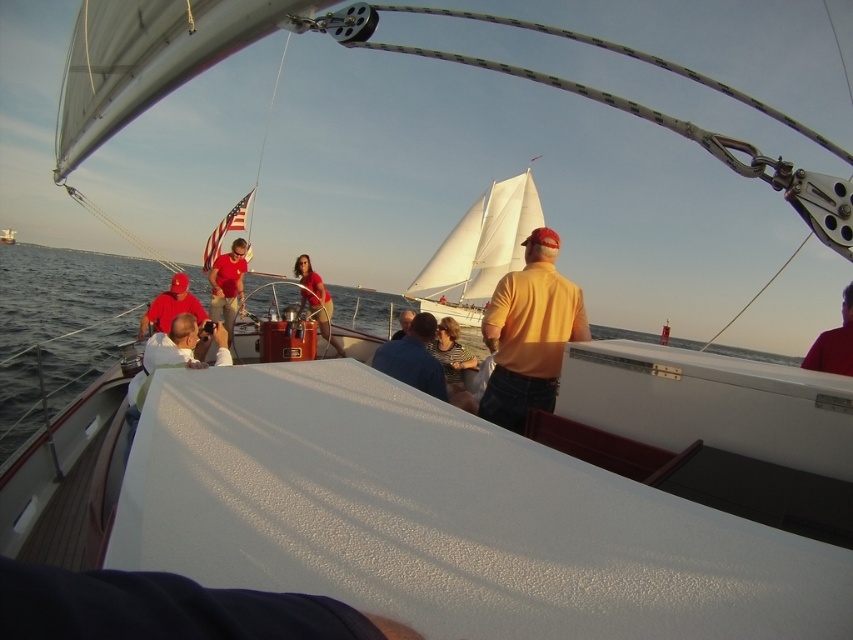
Can you confirm if matte red shorts at center is positioned to the left of striped cotton shirt at center?

Yes, matte red shorts at center is to the left of striped cotton shirt at center.

The image size is (853, 640). Describe the element at coordinates (315, 300) in the screenshot. I see `matte red shorts at center` at that location.

At what (x,y) coordinates should I click in order to perform the action: click on matte red shorts at center. Please return your answer as a coordinate pair (x, y). Image resolution: width=853 pixels, height=640 pixels. Looking at the image, I should click on (315, 300).

Does blue denim shirt at center appear under matte red shirt at center?

Correct, blue denim shirt at center is located below matte red shirt at center.

Is blue denim shirt at center further to the viewer compared to matte red shirt at center?

No, it is not.

Which is behind, point (396, 353) or point (241, 291)?

The point (241, 291) is more distant.

The height and width of the screenshot is (640, 853). I want to click on blue denim shirt at center, so (413, 356).

Which of these two, orange matte shirt at center or matte yellow shirt at center, stands shorter?

Standing shorter between the two is matte yellow shirt at center.

Between point (544, 372) and point (402, 316), which one is positioned in front?

Point (544, 372) is in front.

Which is in front, point (547, 371) or point (405, 316)?

Point (547, 371) is in front.

Locate an element on the screen. orange matte shirt at center is located at coordinates (529, 333).